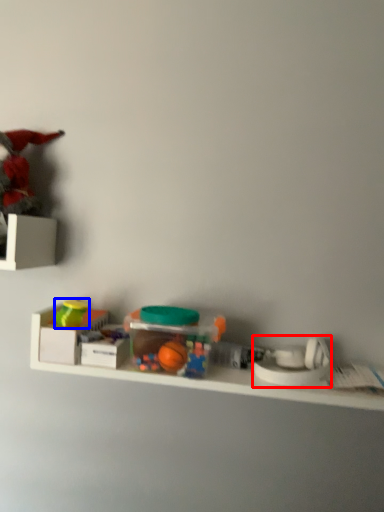
Question: Among these objects, which one is nearest to the camera, toy (highlighted by a red box) or toy (highlighted by a blue box)?

Choices:
 (A) toy
 (B) toy

Answer: (A)